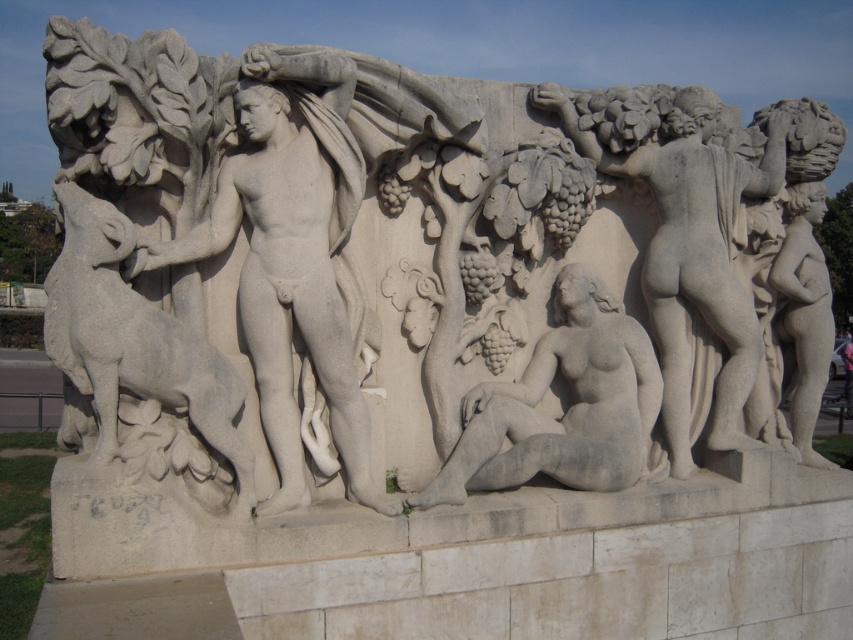
Between white stone statue at left and white marble figure at right, which one appears on the right side from the viewer's perspective?

white marble figure at right

Can you confirm if white stone statue at left is thinner than white marble figure at right?

Yes, white stone statue at left is thinner than white marble figure at right.

Who is more distant from viewer, (180, 262) or (746, 445)?

The point (746, 445) is behind.

I want to click on white stone statue at left, so click(291, 256).